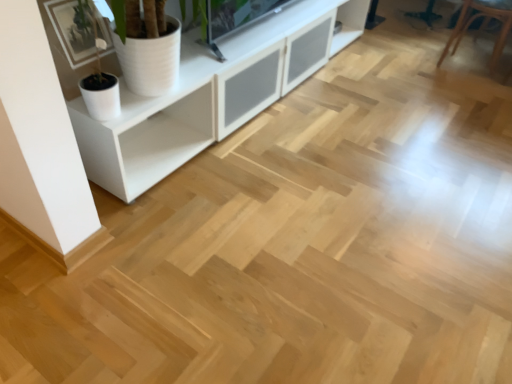
Question: From the image's perspective, is white matte cabinet at upper left positioned above or below brown leather armchair at upper right?

Choices:
 (A) below
 (B) above

Answer: (A)

Question: In terms of height, does white matte cabinet at upper left look taller or shorter compared to brown leather armchair at upper right?

Choices:
 (A) tall
 (B) short

Answer: (A)

Question: Which of these objects is positioned closest to the white matte cabinet at upper left?

Choices:
 (A) brown leather armchair at upper right
 (B) white matte pot at upper left

Answer: (B)

Question: Which object is the closest to the brown leather armchair at upper right?

Choices:
 (A) white matte cabinet at upper left
 (B) white matte pot at upper left

Answer: (A)